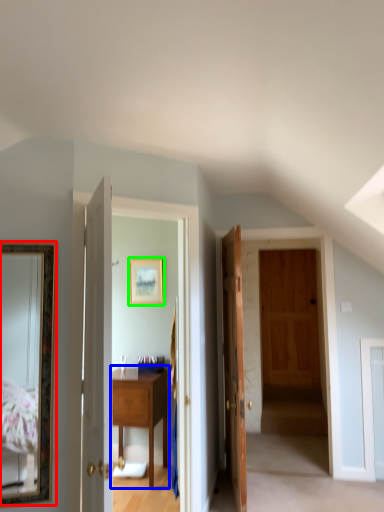
Question: Estimate the real-world distances between objects in this image. Which object is closer to mirror (highlighted by a red box), table (highlighted by a blue box) or picture frame (highlighted by a green box)?

Choices:
 (A) table
 (B) picture frame

Answer: (A)